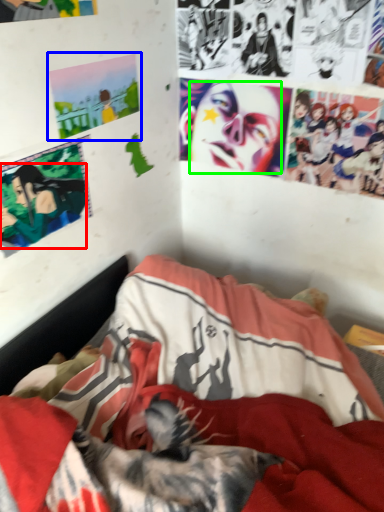
Question: Which is farther away from person (highlighted by a red box)? poster page (highlighted by a blue box) or human face (highlighted by a green box)?

Choices:
 (A) poster page
 (B) human face

Answer: (B)